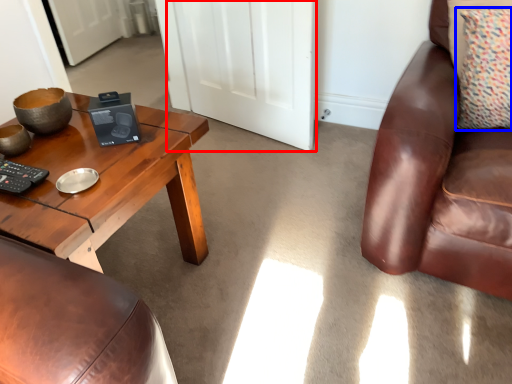
Question: Among these objects, which one is nearest to the camera, door (highlighted by a red box) or pillow (highlighted by a blue box)?

Choices:
 (A) door
 (B) pillow

Answer: (B)